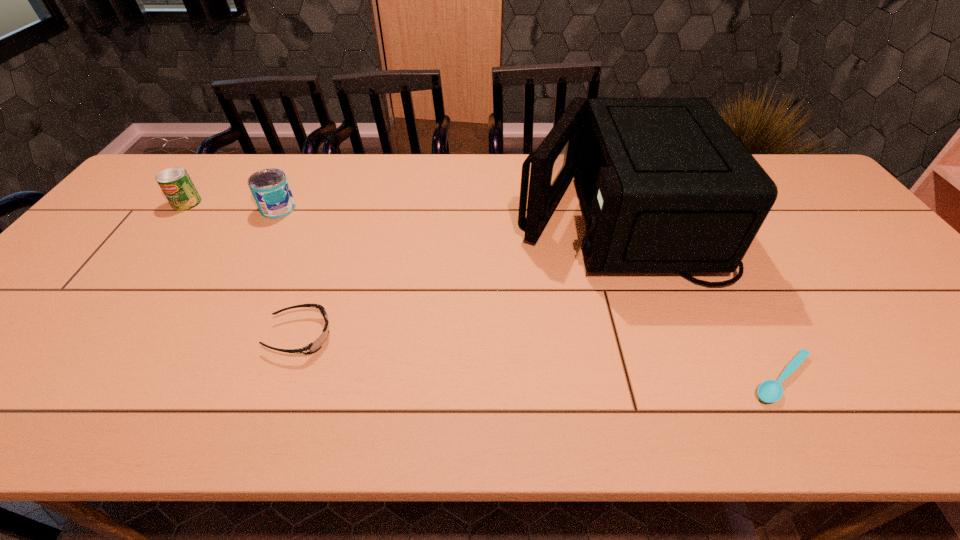
I want to click on vacant region located 0.140m on the back of the leftmost object, so click(212, 170).

At what (x,y) coordinates should I click in order to perform the action: click on blank area located 0.180m on the lenses of the sunglasses. Please return your answer as a coordinate pair (x, y). The width and height of the screenshot is (960, 540). Looking at the image, I should click on (412, 336).

The height and width of the screenshot is (540, 960). In order to click on free region located 0.310m on the left of the spoon in this screenshot , I will do `click(596, 378)`.

At what (x,y) coordinates should I click in order to perform the action: click on microwave oven situated at the far edge. Please return your answer as a coordinate pair (x, y). Looking at the image, I should click on (666, 186).

Where is `can at the far edge`? The height and width of the screenshot is (540, 960). can at the far edge is located at coordinates (176, 184).

I want to click on object that is at the near edge, so click(769, 391).

I want to click on object located at the left edge, so click(176, 184).

Where is `object present at the far left corner`? This screenshot has width=960, height=540. object present at the far left corner is located at coordinates (176, 184).

I want to click on free space at the far edge of the desktop, so click(288, 160).

Identify the location of free region at the near edge of the desktop. The image size is (960, 540). (875, 392).